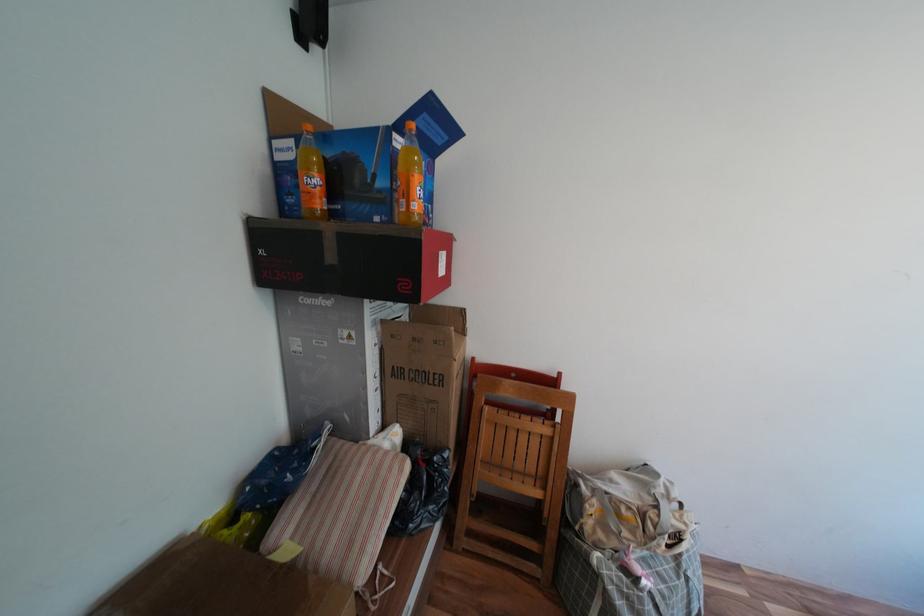
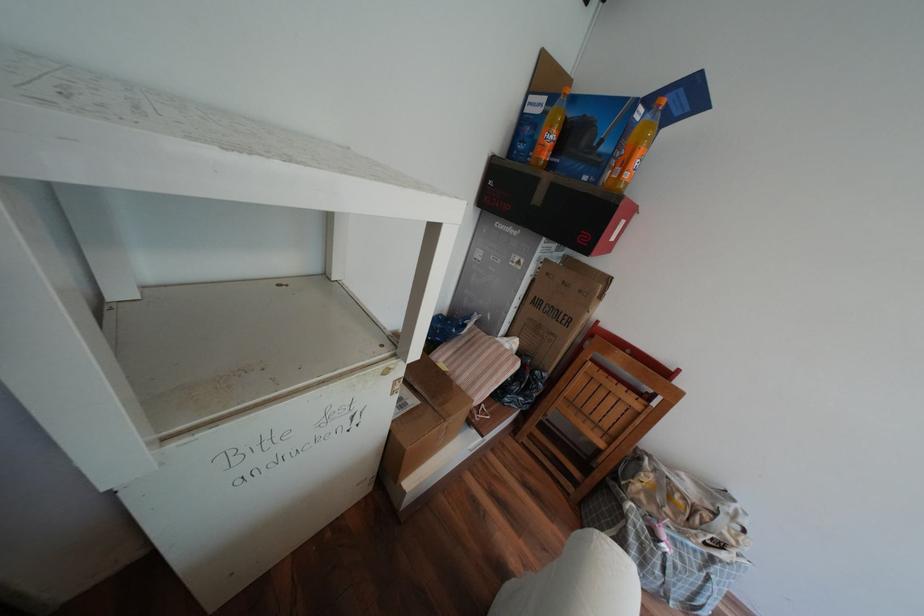
Where in the second image is the point corresponding to point (408, 127) from the first image?

(659, 100)